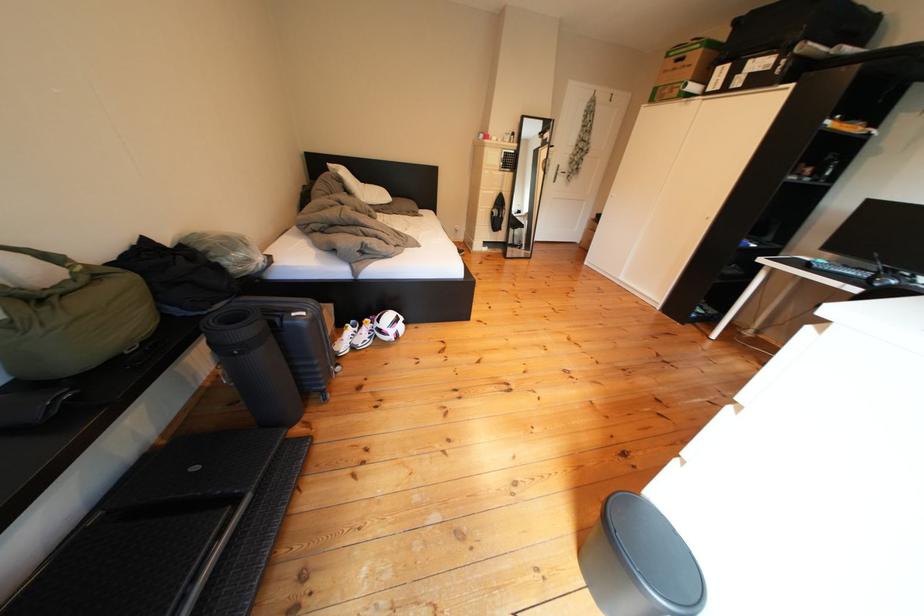
Describe the element at coordinates (639, 562) in the screenshot. I see `the black trash can lid` at that location.